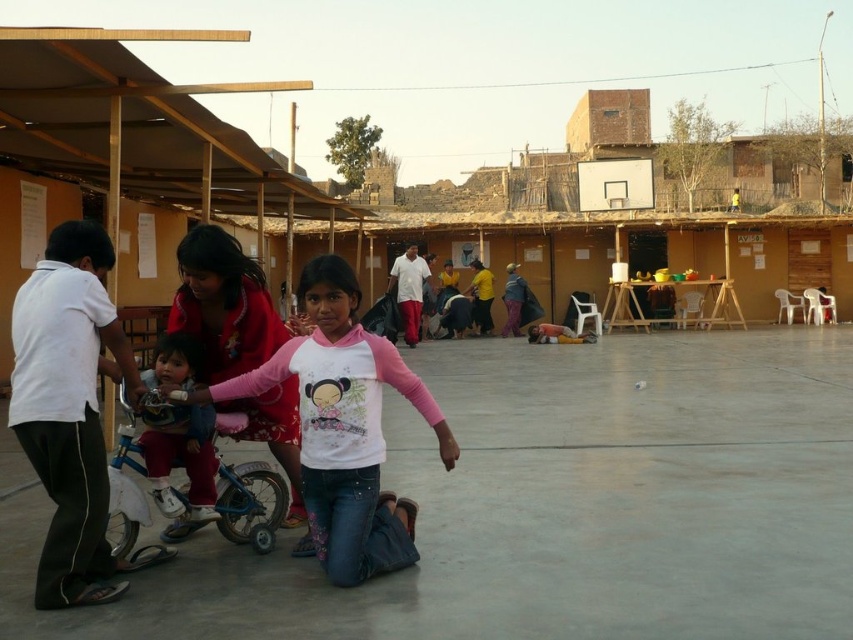
Can you confirm if pink fabric shirt at center is positioned above light pink fabric shirt at center?

Yes.

Measure the distance from pink fabric shirt at center to light pink fabric shirt at center.

They are 19.05 inches apart.

Which is in front, point (318, 461) or point (142, 433)?

Positioned in front is point (318, 461).

The height and width of the screenshot is (640, 853). I want to click on pink fabric shirt at center, so click(x=343, y=426).

The width and height of the screenshot is (853, 640). I want to click on pink fabric shirt at center, so click(343, 426).

The image size is (853, 640). What are the coordinates of `pink fabric shirt at center` in the screenshot? It's located at (343, 426).

Who is more distant from viewer, (229, 525) or (190, 362)?

The point (229, 525) is behind.

Does blue plastic tricycle at center appear over light pink fabric shirt at center?

No.

What do you see at coordinates (248, 502) in the screenshot? Image resolution: width=853 pixels, height=640 pixels. I see `blue plastic tricycle at center` at bounding box center [248, 502].

You are a GUI agent. You are given a task and a screenshot of the screen. Output one action in this format:
    pyautogui.click(x=<x>, y=<y>)
    Task: Click on the blue plastic tricycle at center
    
    Given the screenshot: What is the action you would take?
    pyautogui.click(x=248, y=502)